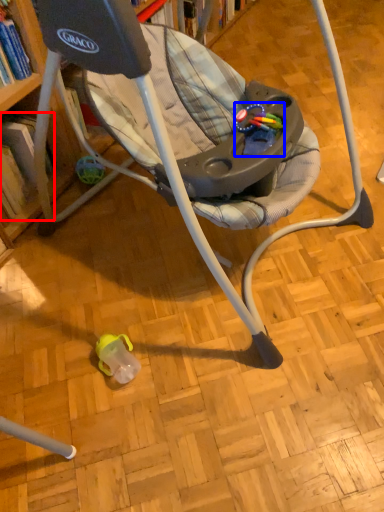
Question: Among these objects, which one is nearest to the camera, book (highlighted by a red box) or toy (highlighted by a blue box)?

Choices:
 (A) book
 (B) toy

Answer: (B)